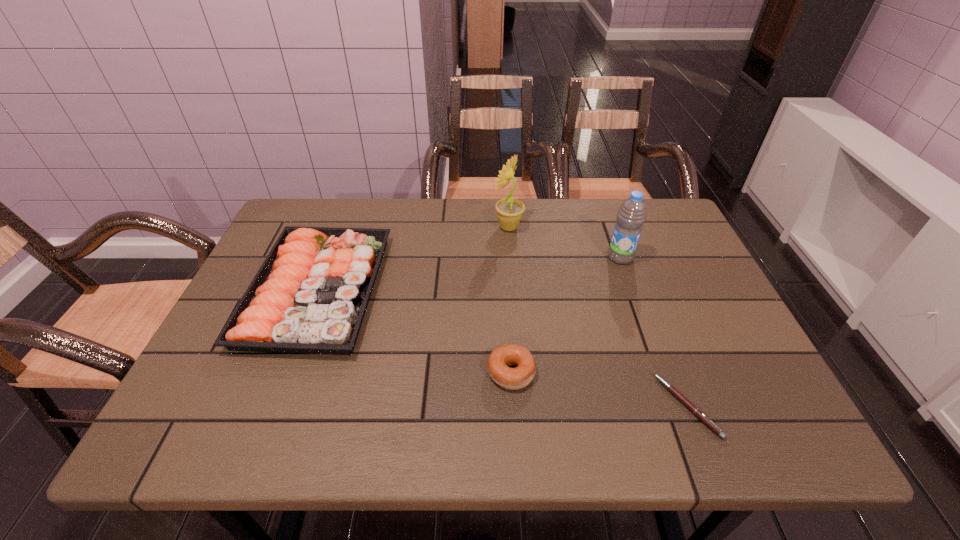
This screenshot has width=960, height=540. I want to click on vacant point that satisfies the following two spatial constraints: 1. on the face of the sunflower; 2. on the right side of the water bottle, so click(x=511, y=258).

Locate an element on the screen. The height and width of the screenshot is (540, 960). blank space that satisfies the following two spatial constraints: 1. on the front side of the fourth tallest object; 2. on the right side of the leftmost object is located at coordinates (286, 372).

Identify the location of free spot that satisfies the following two spatial constraints: 1. on the face of the water bottle; 2. on the left side of the sunflower. (511, 258).

Locate an element on the screen. free location that satisfies the following two spatial constraints: 1. on the back side of the water bottle; 2. on the left side of the platter is located at coordinates (330, 258).

This screenshot has width=960, height=540. In order to click on free space that satisfies the following two spatial constraints: 1. on the front side of the third shortest object; 2. on the right side of the bagel in this screenshot , I will do `click(286, 372)`.

This screenshot has height=540, width=960. What are the coordinates of `blank space that satisfies the following two spatial constraints: 1. on the face of the water bottle; 2. on the right side of the sunflower` in the screenshot? It's located at (511, 258).